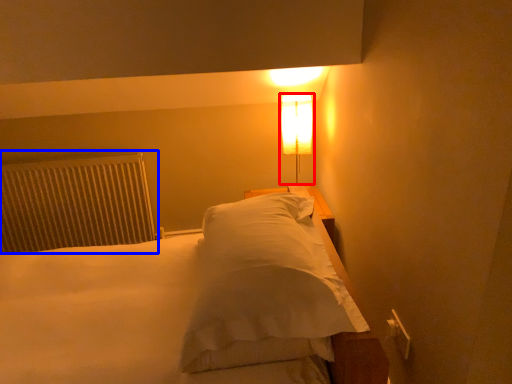
Question: Among these objects, which one is farthest to the camera, lamp (highlighted by a red box) or radiator (highlighted by a blue box)?

Choices:
 (A) lamp
 (B) radiator

Answer: (B)